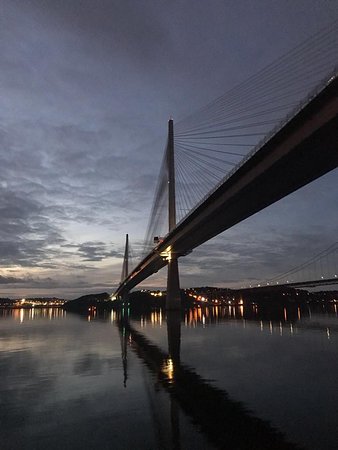
Where is `wires`? This screenshot has width=338, height=450. wires is located at coordinates (188, 175).